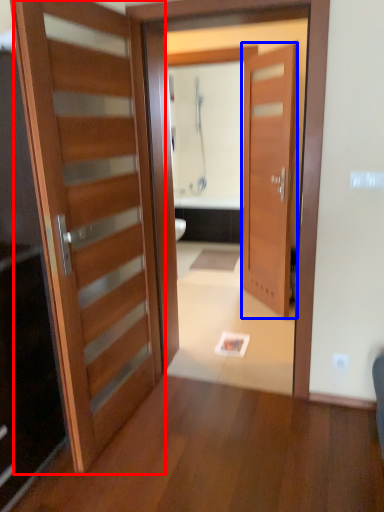
Question: Which point is further to the camera, door (highlighted by a red box) or door (highlighted by a blue box)?

Choices:
 (A) door
 (B) door

Answer: (B)